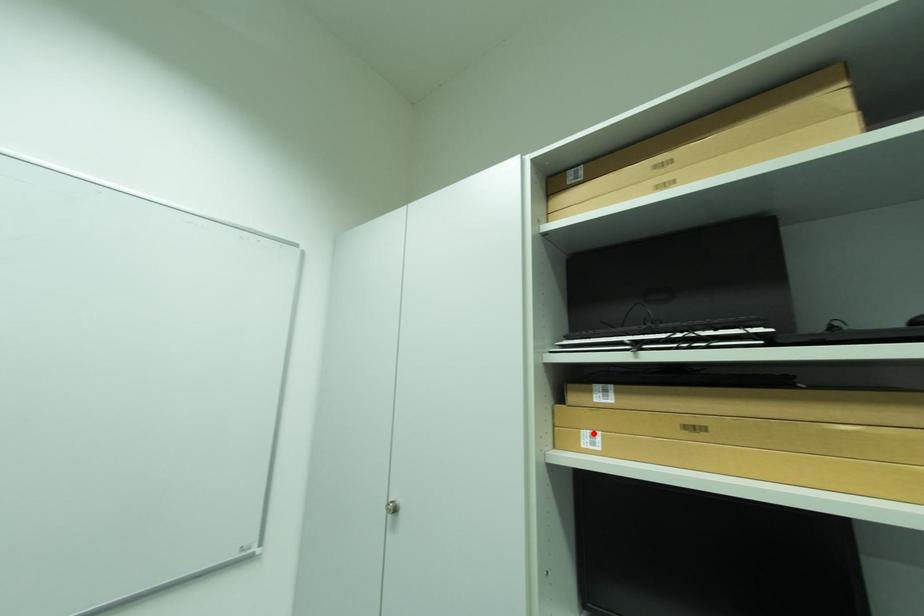
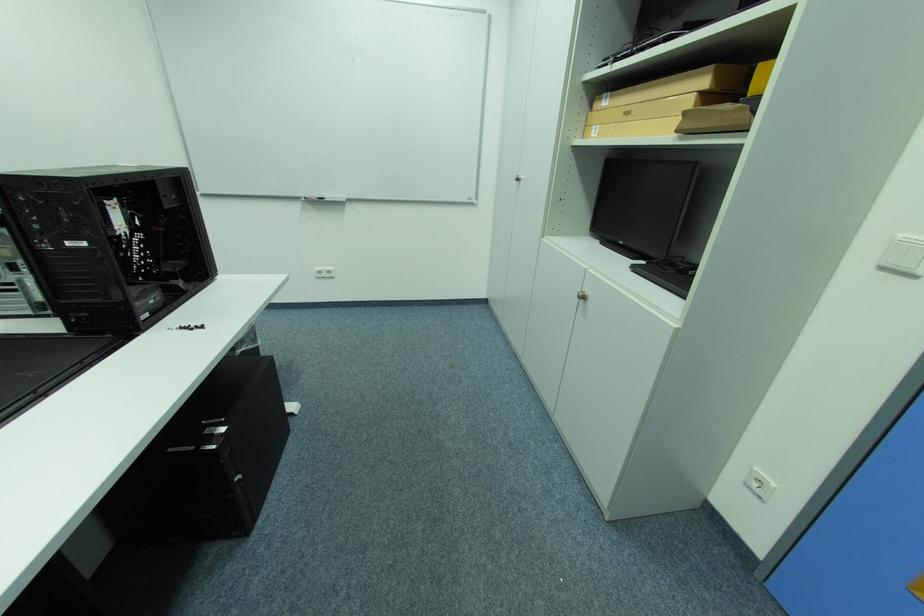
Find the pixel in the second image that matches the highlighted location in the first image.

(602, 128)